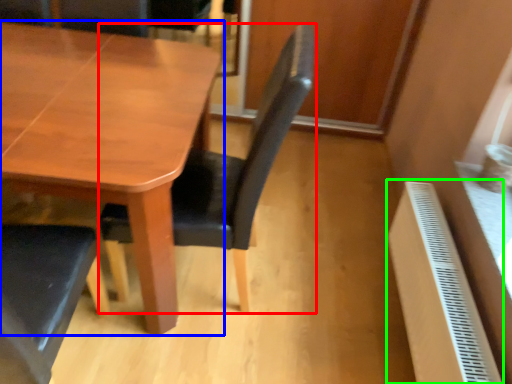
Question: Estimate the real-world distances between objects in this image. Which object is farther from chair (highlighted by a red box), table (highlighted by a blue box) or radiator (highlighted by a green box)?

Choices:
 (A) table
 (B) radiator

Answer: (B)